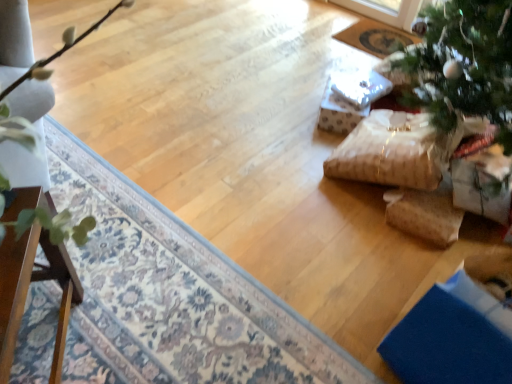
Where is `vacant region under wooden coffee table at lower left (from a real-world perspective)`? vacant region under wooden coffee table at lower left (from a real-world perspective) is located at coordinates (50, 344).